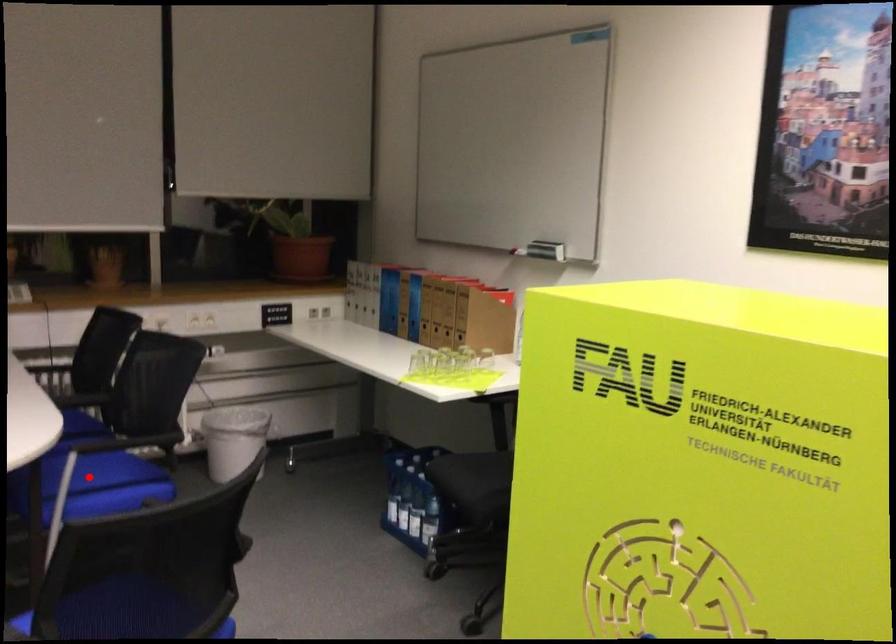
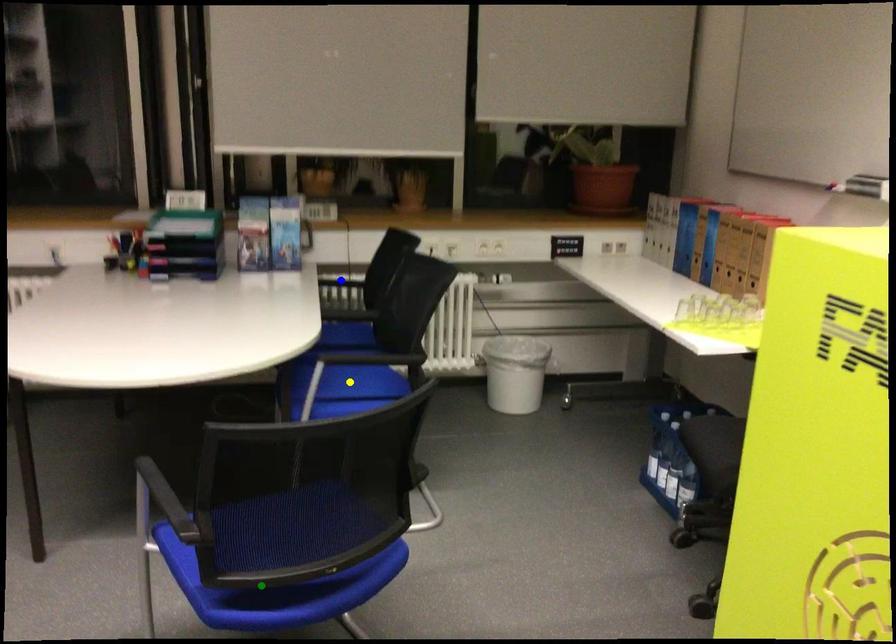
Question: I am providing you with two images of the same scene from different viewpoints. A red point is marked on the first image. You are given multiple points on the second image. Which point in image 2 represents the same 3d spot as the red point in image 1?

Choices:
 (A) green point
 (B) yellow point
 (C) blue point

Answer: (B)